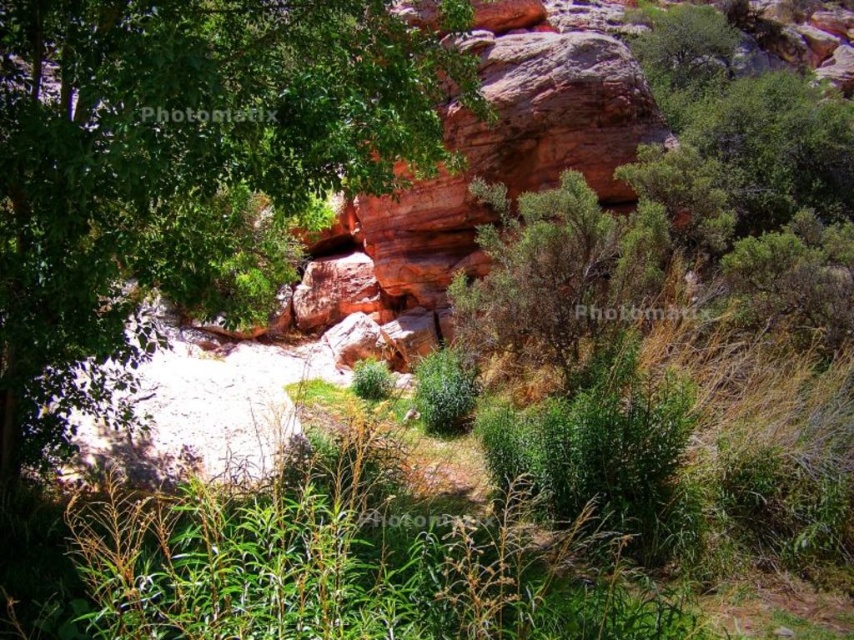
Question: In this image, where is reddish-brown rock at center located relative to green leafy bush at center?

Choices:
 (A) left
 (B) right

Answer: (A)

Question: Which object is the closest to the green leafy tree at upper left?

Choices:
 (A) green leafy bush at center
 (B) reddish-brown rock at center

Answer: (A)

Question: Which of the following is the closest to the observer?

Choices:
 (A) (496, 44)
 (B) (601, 356)
 (C) (180, 80)

Answer: (C)

Question: Does reddish-brown rock at center appear over green leafy bush at center?

Choices:
 (A) no
 (B) yes

Answer: (B)

Question: Does green leafy tree at upper left lie behind green leafy bush at center?

Choices:
 (A) yes
 (B) no

Answer: (B)

Question: Which of the following is the closest to the observer?

Choices:
 (A) tap(203, 148)
 (B) tap(607, 227)

Answer: (A)